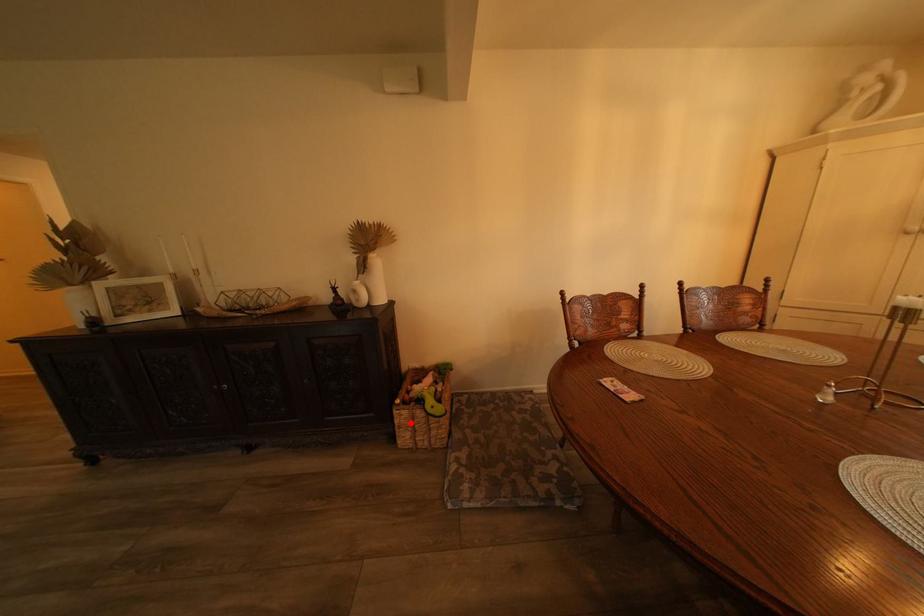
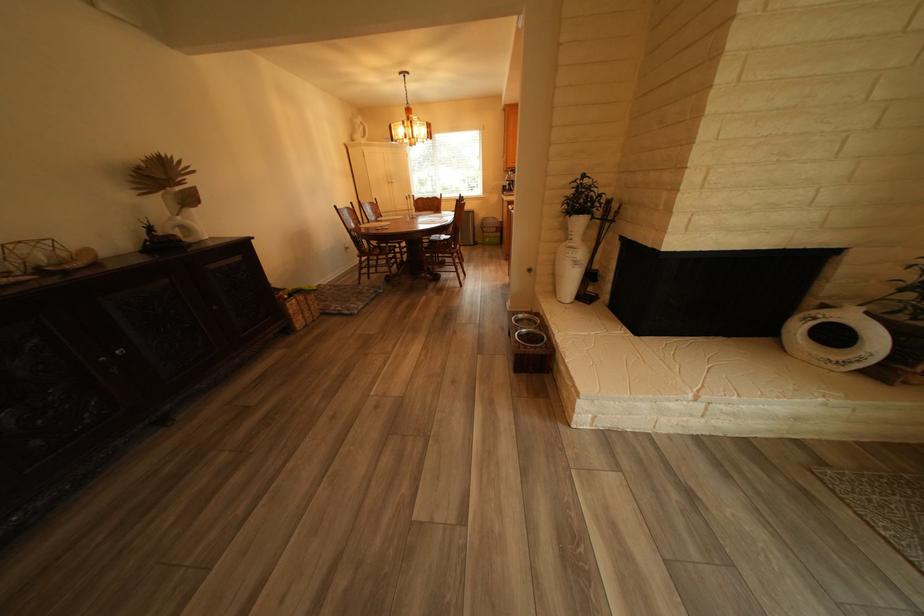
In the second image, find the point that corresponds to the highlighted location in the first image.

(305, 312)